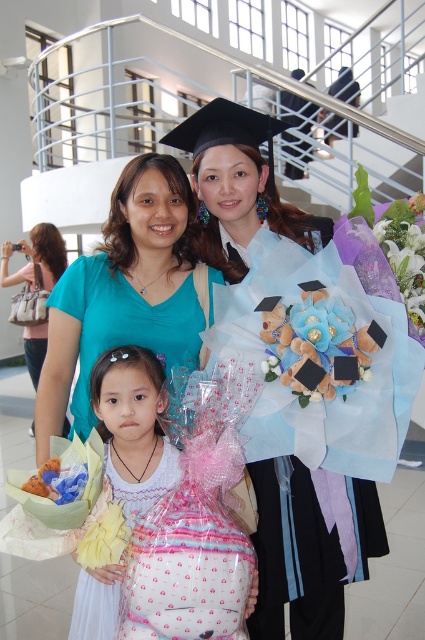
Question: Estimate the real-world distances between objects in this image. Which object is closer to the pink polka dot dress at center?

Choices:
 (A) pink fabric gift bag at center
 (B) matte teal shirt at center

Answer: (A)

Question: Which point appears closest to the camera in this image?

Choices:
 (A) [x=112, y=593]
 (B) [x=61, y=262]
 (C) [x=271, y=198]
 (D) [x=112, y=438]

Answer: (A)

Question: Is pink fabric gift bag at center in front of pink polka dot dress at center?

Choices:
 (A) no
 (B) yes

Answer: (A)

Question: Does pink polka dot dress at center have a greater width compared to matte teal shirt at center?

Choices:
 (A) no
 (B) yes

Answer: (A)

Question: Can you confirm if matte black graduation gown at center is bigger than matte teal shirt at center?

Choices:
 (A) no
 (B) yes

Answer: (A)

Question: Which object is closer to the camera taking this photo?

Choices:
 (A) pink polka dot dress at center
 (B) pink fabric gift bag at center
 (C) matte teal shirt at center
 (D) matte black graduation gown at center

Answer: (A)